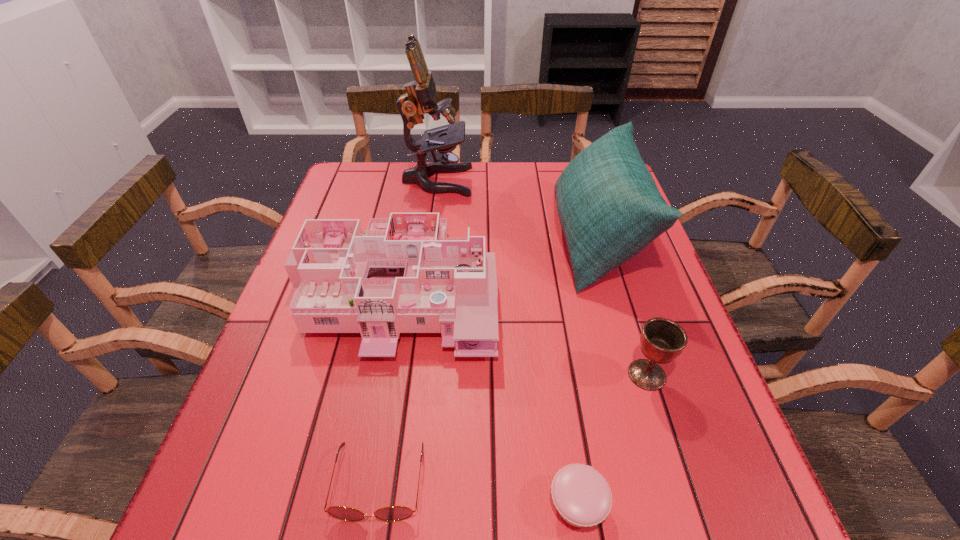
Where is `vacant space in between the cupcake and the dollhouse`? This screenshot has width=960, height=540. vacant space in between the cupcake and the dollhouse is located at coordinates (487, 396).

At what (x,y) coordinates should I click in order to perform the action: click on vacant space that's between the cupcake and the microscope. Please return your answer as a coordinate pair (x, y). Looking at the image, I should click on (507, 343).

This screenshot has width=960, height=540. Identify the location of vacant space that is in between the cushion and the cupcake. (587, 372).

You are a GUI agent. You are given a task and a screenshot of the screen. Output one action in this format:
    pyautogui.click(x=<x>, y=<y>)
    Task: Click on the vacant area that lies between the dollhouse and the sunglasses
    
    Given the screenshot: What is the action you would take?
    pyautogui.click(x=387, y=386)

The height and width of the screenshot is (540, 960). Find the location of `unoccupied area between the sunglasses and the cushion`. unoccupied area between the sunglasses and the cushion is located at coordinates (488, 361).

You are a GUI agent. You are given a task and a screenshot of the screen. Output one action in this format:
    pyautogui.click(x=<x>, y=<y>)
    Task: Click on the object that stands as the fourth closest to the chalice
    The width and height of the screenshot is (960, 540).
    Given the screenshot: What is the action you would take?
    pyautogui.click(x=393, y=513)

Select which object appears as the fourth closest to the chalice. Please provide its 2D coordinates. Your answer should be formatted as a tuple, i.e. [(x, y)], where the tuple contains the x and y coordinates of a point satisfying the conditions above.

[(393, 513)]

The height and width of the screenshot is (540, 960). Identify the location of free region that satisfies the following two spatial constraints: 1. on the lenses of the cupcake; 2. on the right side of the sunglasses. (375, 504).

I want to click on vacant region that satisfies the following two spatial constraints: 1. at the eyepieces of the microscope; 2. at the front entrance of the dollhouse, so click(423, 288).

Image resolution: width=960 pixels, height=540 pixels. I want to click on blank area in the image that satisfies the following two spatial constraints: 1. at the front entrance of the chalice; 2. on the left side of the dollhouse, so click(x=379, y=375).